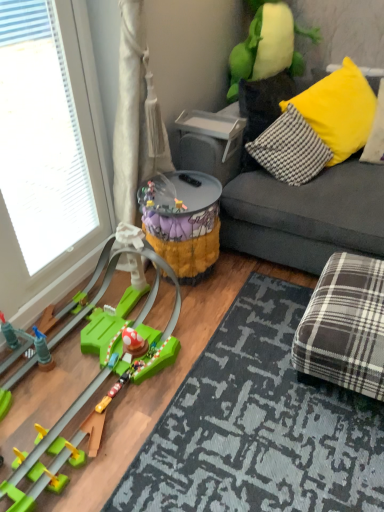
Question: Considering the positions of yellow fabric pillow at upper right, the 1th pillow positioned from the right, and soft plush toy at upper right, acting as the 3th toy starting from the bottom, in the image, is yellow fabric pillow at upper right, the 1th pillow positioned from the right, wider or thinner than soft plush toy at upper right, acting as the 3th toy starting from the bottom,?

Choices:
 (A) thin
 (B) wide

Answer: (A)

Question: Is point (379, 83) closer or farther from the camera than point (266, 15)?

Choices:
 (A) farther
 (B) closer

Answer: (A)

Question: Estimate the real-world distances between objects in this image. Which object is closer to the brown plaid stool at lower right?

Choices:
 (A) transparent glass window at left
 (B) camouflage fabric bucket at center, which ranks as the 2th toy in bottom-to-top order
 (C) yellow fabric pillow at upper right, which is the 1th pillow from left to right
 (D) green plastic toy at lower left, acting as the first toy starting from the bottom
 (E) dark gray fabric couch at center

Answer: (E)

Question: Based on their relative distances, which object is farther from the yellow fabric pillow at upper right, which is the second pillow in left-to-right order?

Choices:
 (A) plaid fabric mat at lower right
 (B) dark gray fabric couch at center
 (C) transparent glass window at left
 (D) green plastic toy at lower left, acting as the first toy starting from the bottom
 (E) soft plush toy at upper right, acting as the 3th toy starting from the bottom

Answer: (C)